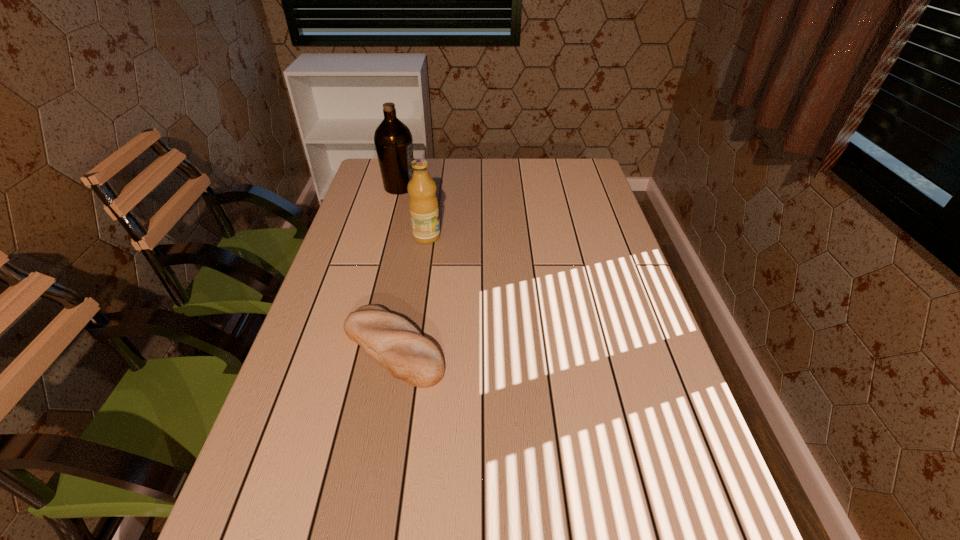
I want to click on olive oil positioned at the left edge, so click(x=393, y=141).

Image resolution: width=960 pixels, height=540 pixels. What are the coordinates of `bread located in the left edge section of the desktop` in the screenshot? It's located at (392, 341).

The height and width of the screenshot is (540, 960). I want to click on object that is at the far left corner, so click(393, 141).

Where is `vacant space at the far edge of the desktop`? vacant space at the far edge of the desktop is located at coordinates (542, 189).

The height and width of the screenshot is (540, 960). I want to click on free region at the left edge of the desktop, so click(298, 411).

Find the location of a particular element. free location at the right edge of the desktop is located at coordinates (602, 227).

Where is `vacant region at the far right corner`? This screenshot has width=960, height=540. vacant region at the far right corner is located at coordinates (575, 176).

Locate an element on the screen. free space between the nearest object and the second tallest object is located at coordinates coord(410,292).

I want to click on free point between the bread and the tallest object, so click(396, 267).

Where is `object that is the second nearest to the second farthest object`? object that is the second nearest to the second farthest object is located at coordinates (392, 341).